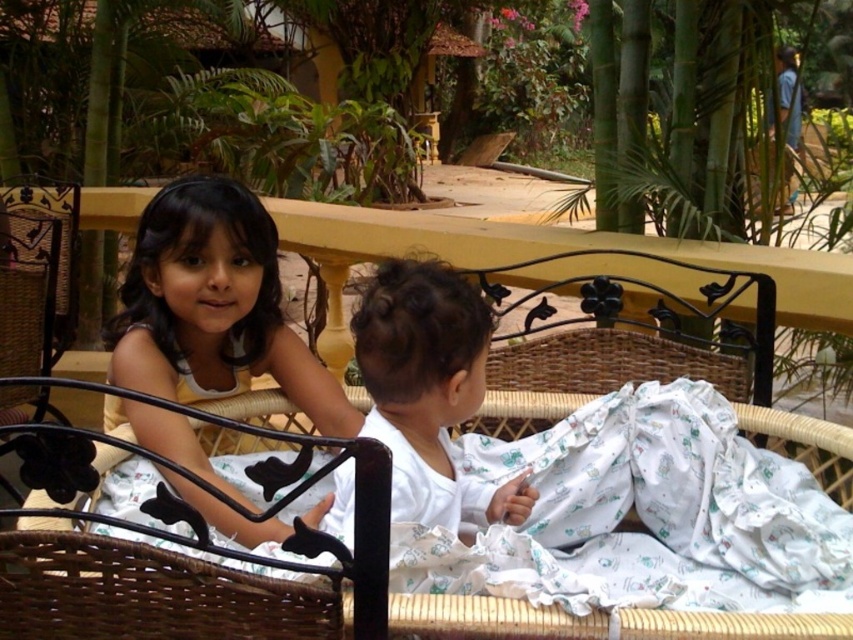
Is point (167, 416) in front of point (361, 368)?

That is False.

Does matte yellow dress at upper left lie behind white soft fabric at center?

That is True.

What do you see at coordinates (213, 307) in the screenshot? This screenshot has width=853, height=640. I see `matte yellow dress at upper left` at bounding box center [213, 307].

Identify the location of matte yellow dress at upper left. (213, 307).